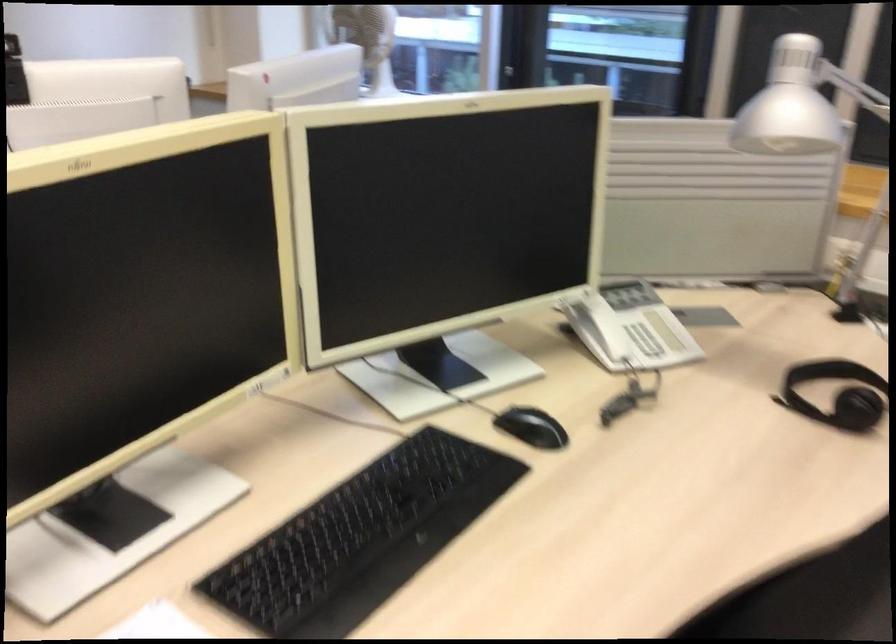
This screenshot has width=896, height=644. In order to click on black keyboard in this screenshot , I will do `click(362, 538)`.